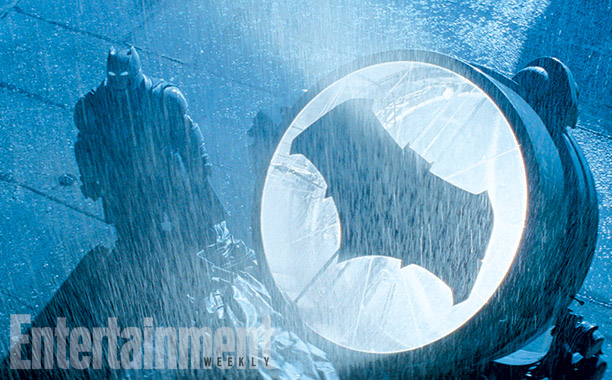
Locate an element on the screen. The image size is (612, 380). light illuminating is located at coordinates (469, 145).